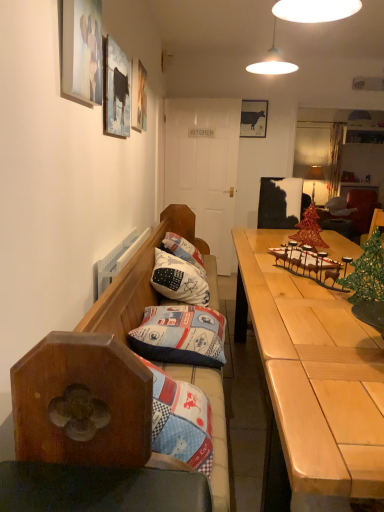
Question: Could you tell me if velvet dark brown bean bag chair at right is turned towards wooden bench with cushions at left?

Choices:
 (A) yes
 (B) no

Answer: (A)

Question: Is velvet dark brown bean bag chair at right taller than wooden bench with cushions at left?

Choices:
 (A) yes
 (B) no

Answer: (B)

Question: Can you confirm if velvet dark brown bean bag chair at right is positioned to the left of wooden bench with cushions at left?

Choices:
 (A) yes
 (B) no

Answer: (B)

Question: Considering the relative sizes of velvet dark brown bean bag chair at right and wooden bench with cushions at left in the image provided, is velvet dark brown bean bag chair at right smaller than wooden bench with cushions at left?

Choices:
 (A) yes
 (B) no

Answer: (A)

Question: Is velvet dark brown bean bag chair at right bigger than wooden bench with cushions at left?

Choices:
 (A) yes
 (B) no

Answer: (B)

Question: Considering the positions of matte wooden picture frame at upper left, the 1th picture frame viewed from the front, and white cotton pillow at center, the 2th pillow in the front-to-back sequence, in the image, is matte wooden picture frame at upper left, the 1th picture frame viewed from the front, bigger or smaller than white cotton pillow at center, the 2th pillow in the front-to-back sequence,?

Choices:
 (A) big
 (B) small

Answer: (B)

Question: From the image's perspective, is matte wooden picture frame at upper left, the 1th picture frame when ordered from left to right, positioned above or below white cotton pillow at center, the 2th pillow in the front-to-back sequence?

Choices:
 (A) above
 (B) below

Answer: (A)

Question: Is matte wooden picture frame at upper left, marked as the 4th picture frame in a right-to-left arrangement, taller or shorter than white cotton pillow at center, the 2th pillow in the front-to-back sequence?

Choices:
 (A) short
 (B) tall

Answer: (B)

Question: Considering their positions, is matte wooden picture frame at upper left, the fourth picture frame viewed from the back, located in front of or behind white cotton pillow at center, placed as the first pillow when sorted from back to front?

Choices:
 (A) front
 (B) behind

Answer: (A)

Question: Based on their positions, is light wood table at right located to the left or right of matte glass lampshade at upper right?

Choices:
 (A) right
 (B) left

Answer: (B)

Question: From a real-world perspective, is light wood table at right physically located above or below matte glass lampshade at upper right?

Choices:
 (A) above
 (B) below

Answer: (B)

Question: Choose the correct answer: Is light wood table at right inside matte glass lampshade at upper right or outside it?

Choices:
 (A) inside
 (B) outside

Answer: (B)

Question: From the image's perspective, relative to matte glass lampshade at upper right, is light wood table at right above or below?

Choices:
 (A) above
 (B) below

Answer: (B)

Question: From the image's perspective, relative to white cotton pillow at center, the 2th pillow in the front-to-back sequence, is matte wooden picture frame at upper left, which is the 2th picture frame in front-to-back order, above or below?

Choices:
 (A) above
 (B) below

Answer: (A)

Question: Is matte wooden picture frame at upper left, marked as the third picture frame in a right-to-left arrangement, to the left or to the right of white cotton pillow at center, the 2th pillow in the front-to-back sequence, in the image?

Choices:
 (A) right
 (B) left

Answer: (B)